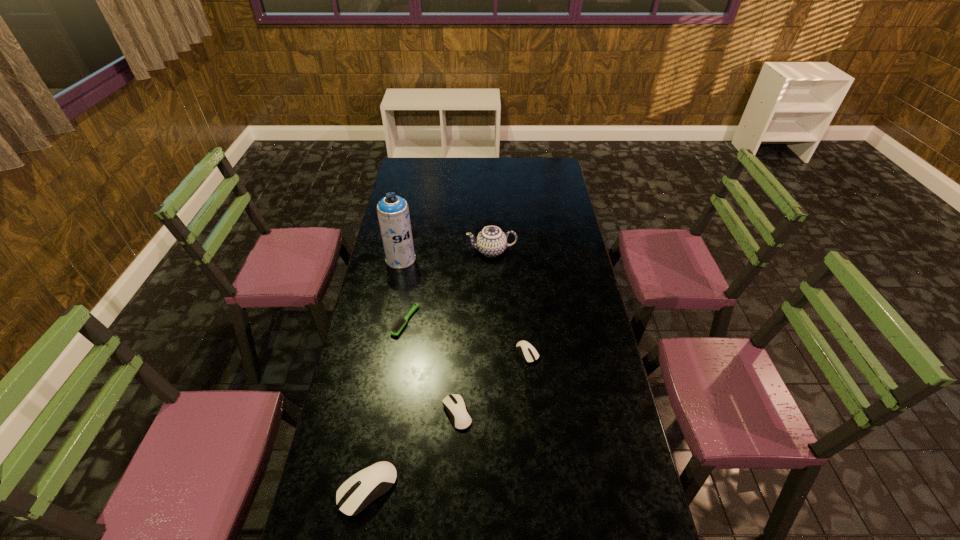
At what (x,y) coordinates should I click in order to perform the action: click on mouse object that ranks as the second closest to the aerosol can. Please return your answer as a coordinate pair (x, y). Image resolution: width=960 pixels, height=540 pixels. Looking at the image, I should click on (460, 417).

Select which mouse appears as the second closest to the third farthest object. Please provide its 2D coordinates. Your answer should be formatted as a tuple, i.e. [(x, y)], where the tuple contains the x and y coordinates of a point satisfying the conditions above.

[(529, 354)]

Find the location of `vacant region that satisfies the following two spatial constraints: 1. from the spout of the fifth shortest object; 2. on the front side of the third farthest object`. vacant region that satisfies the following two spatial constraints: 1. from the spout of the fifth shortest object; 2. on the front side of the third farthest object is located at coordinates (493, 321).

Find the location of `free region that satisfies the following two spatial constraints: 1. from the spout of the chinaware; 2. on the front side of the third farthest object`. free region that satisfies the following two spatial constraints: 1. from the spout of the chinaware; 2. on the front side of the third farthest object is located at coordinates (493, 321).

Find the location of `free space that satisfies the following two spatial constraints: 1. on the back side of the third shortest object; 2. on the left side of the fourth shortest object`. free space that satisfies the following two spatial constraints: 1. on the back side of the third shortest object; 2. on the left side of the fourth shortest object is located at coordinates (381, 413).